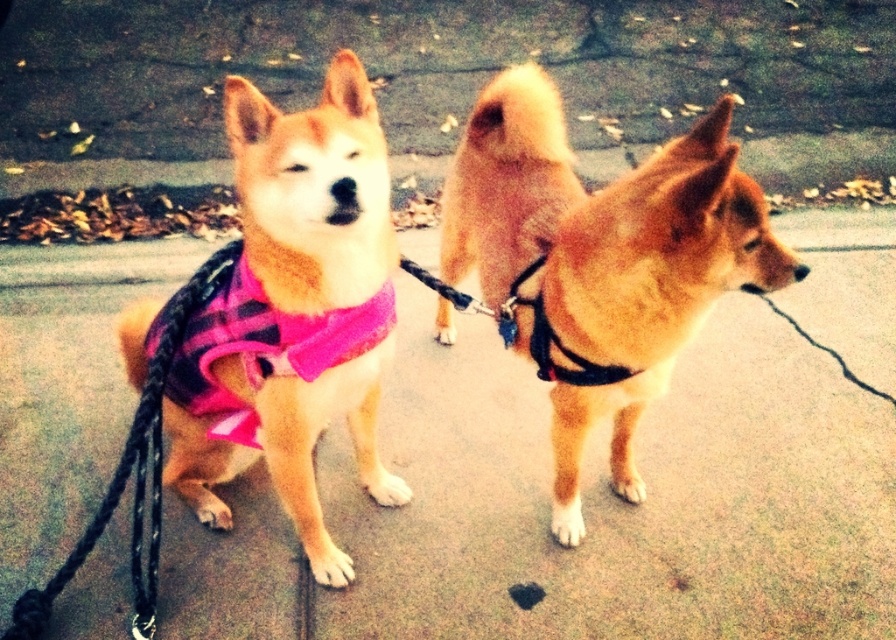
You are a dog owner trying to decide which item to grab first from the ground between the golden fur dog at center and the matte pink fabric at center. If you can only reach one, which one is closer to you?

The golden fur dog at center is closer to you because its width is less than the matte pink fabric at center, indicating it is nearer in the scene.

You are a photographer setting up a shot of the two dogs. You want to focus on the matte pink fabric at center and the pink fabric neckband at center. Which object should you adjust your focus on first if you want to ensure both are in focus?

The matte pink fabric at center is closer to the viewer than the pink fabric neckband at center, so you should focus on the matte pink fabric at center first to ensure both are in focus.